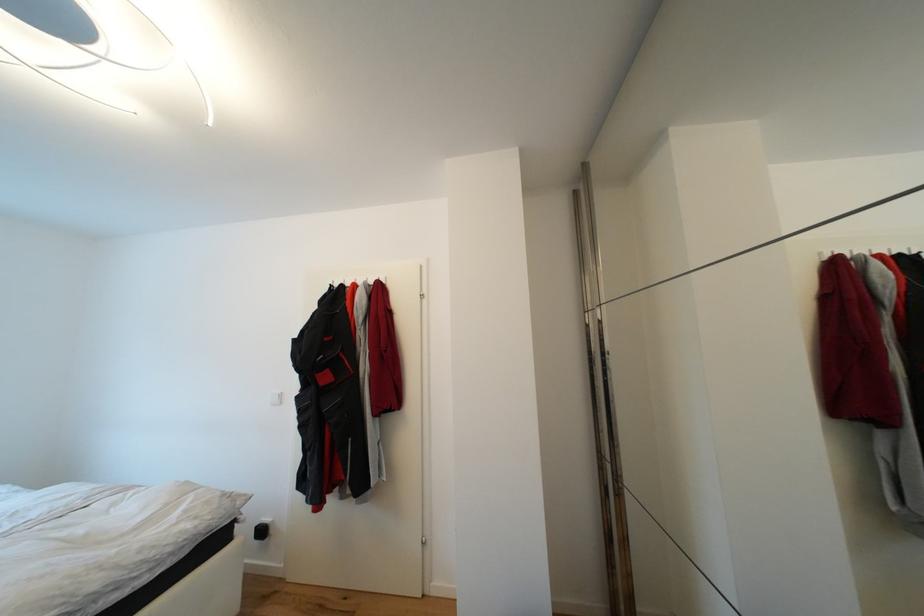
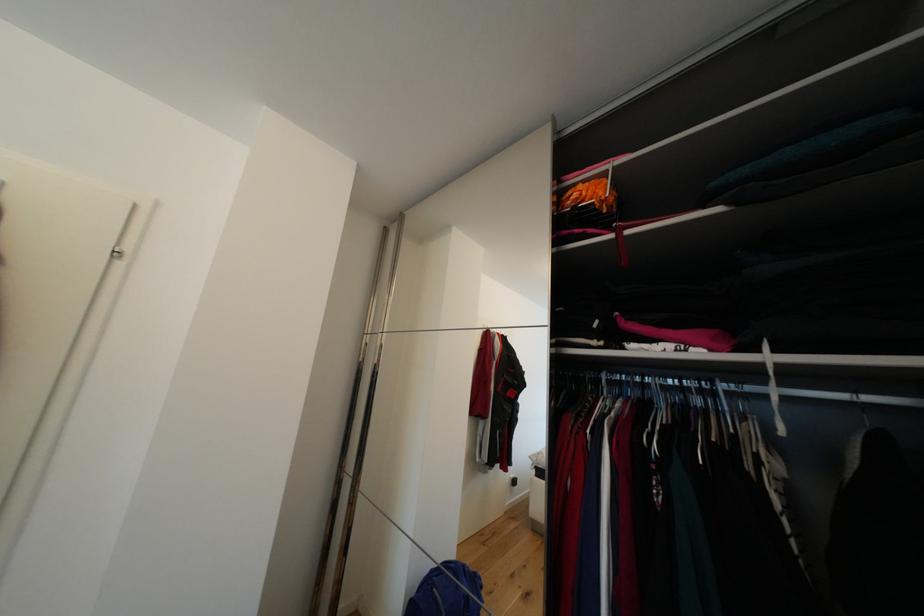
Question: The camera is either moving clockwise (left) or counter-clockwise (right) around the object. The first image is from the beginning of the video and the second image is from the end. Is the camera moving left or right when shooting the video?

Choices:
 (A) Left
 (B) Right

Answer: (A)